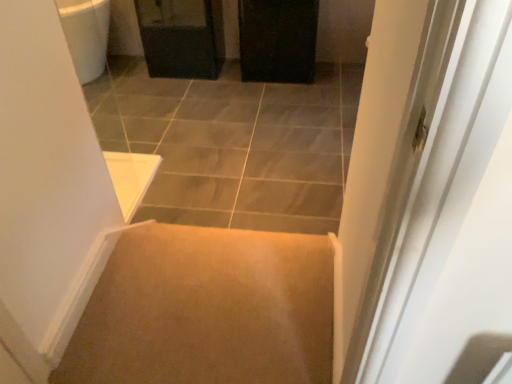
Question: Does point (198, 66) appear closer or farther from the camera than point (212, 84)?

Choices:
 (A) closer
 (B) farther

Answer: (A)

Question: In terms of height, does matte black cabinet at upper center look taller or shorter compared to carpet at center?

Choices:
 (A) short
 (B) tall

Answer: (B)

Question: Estimate the real-world distances between objects in this image. Which object is closer to the matte black cabinet at upper center?

Choices:
 (A) black matte cabinet at upper center
 (B) carpet at center

Answer: (A)

Question: Considering the real-world distances, which object is farthest from the matte black cabinet at upper center?

Choices:
 (A) carpet at center
 (B) black matte cabinet at upper center

Answer: (A)